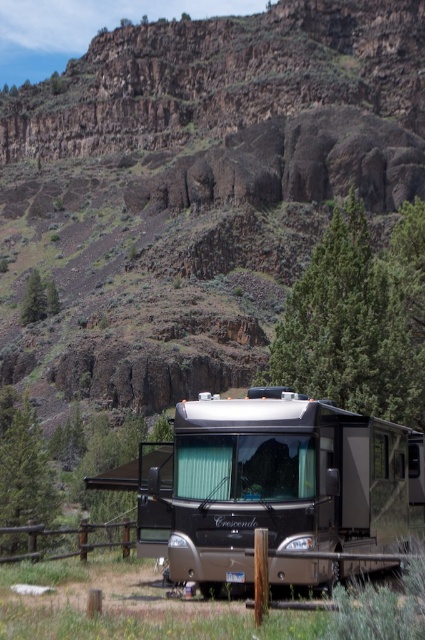
Question: Observing the image, what is the correct spatial positioning of metallic silver rv at center in reference to green pine tree at left?

Choices:
 (A) below
 (B) above

Answer: (B)

Question: Which point is farther from the camera taking this photo?

Choices:
 (A) 209,518
 (B) 31,280
 (C) 414,118
 (D) 323,362

Answer: (C)

Question: Is rugged rock hillside at upper center above metallic silver rv at center?

Choices:
 (A) no
 (B) yes

Answer: (B)

Question: Considering the real-world distances, which object is closest to the rugged rock hillside at upper center?

Choices:
 (A) green textured pine tree at upper left
 (B) green pine tree at left

Answer: (A)

Question: Which object is positioned farthest from the rugged rock hillside at upper center?

Choices:
 (A) green textured pine tree at upper left
 (B) metallic silver rv at center
 (C) green textured tree at center
 (D) green pine tree at left

Answer: (D)

Question: Does green textured tree at center appear over green pine tree at left?

Choices:
 (A) yes
 (B) no

Answer: (A)